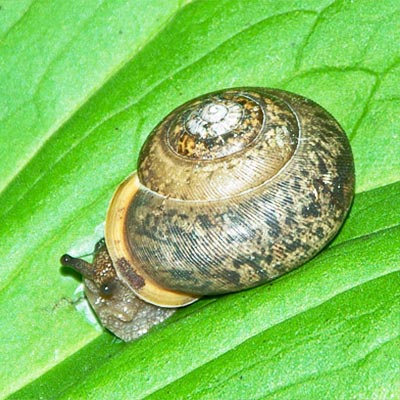
The image size is (400, 400). Identify the location of mantle. (243, 169).